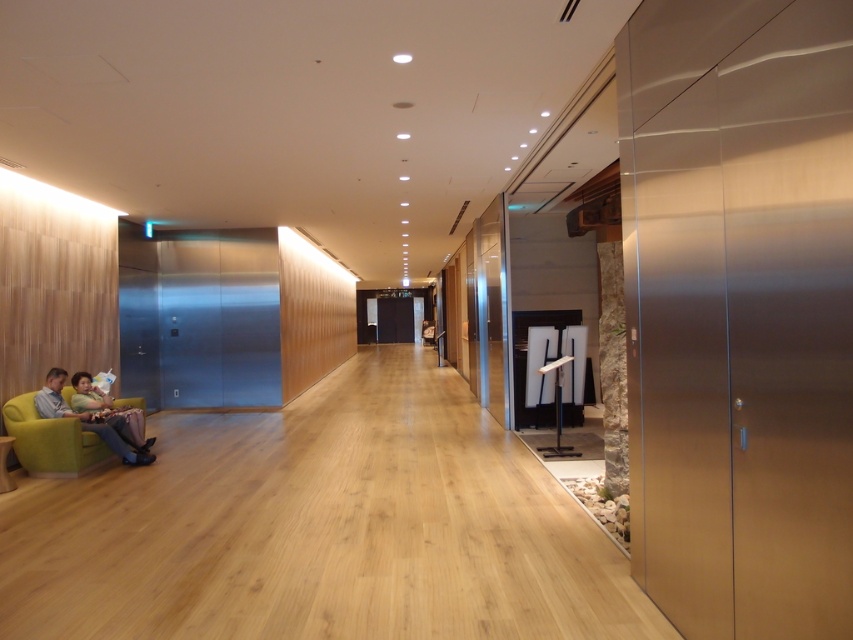
Question: Is matte green fabric armchair at lower left wider than green fabric couch at lower left?

Choices:
 (A) no
 (B) yes

Answer: (A)

Question: Does matte green fabric armchair at lower left have a smaller size compared to green fabric couch at lower left?

Choices:
 (A) no
 (B) yes

Answer: (B)

Question: Among these points, which one is nearest to the camera?

Choices:
 (A) (80, 396)
 (B) (30, 440)

Answer: (B)

Question: Where is matte green fabric armchair at lower left located in relation to green fabric couch at lower left in the image?

Choices:
 (A) above
 (B) below

Answer: (B)

Question: Which object appears farthest from the camera in this image?

Choices:
 (A) matte green fabric armchair at lower left
 (B) green fabric couch at lower left

Answer: (B)